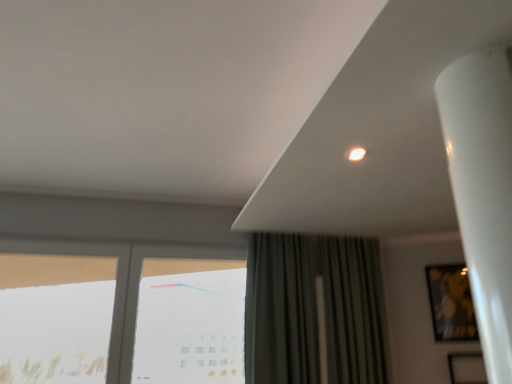
This screenshot has height=384, width=512. What do you see at coordinates (314, 310) in the screenshot? I see `dark green fabric curtain at center` at bounding box center [314, 310].

This screenshot has height=384, width=512. Identify the location of transparent glass window at left, positioned as the 1th window in left-to-right order. (55, 317).

Locate an element on the screen. This screenshot has height=384, width=512. dark green fabric curtain at center is located at coordinates (314, 310).

Is transparent glass window at center, marked as the 3th window in a left-to-right arrangement, facing away from transparent glass window at lower left, marked as the second window in a right-to-left arrangement?

Yes.

The width and height of the screenshot is (512, 384). In order to click on window located underneath the transparent glass window at lower left, marked as the second window in a right-to-left arrangement (from a real-world perspective) in this screenshot , I will do tap(190, 322).

Are transparent glass window at center, marked as the 3th window in a left-to-right arrangement, and transparent glass window at lower left, marked as the second window in a right-to-left arrangement, located far from each other?

They are positioned close to each other.

From a real-world perspective, is transparent glass window at center, marked as the 3th window in a left-to-right arrangement, physically located above or below transparent glass window at lower left, marked as the second window in a right-to-left arrangement?

Clearly, from a real-world perspective, transparent glass window at center, marked as the 3th window in a left-to-right arrangement, is below transparent glass window at lower left, marked as the second window in a right-to-left arrangement.

Looking at their sizes, would you say dark green fabric curtain at center is wider or thinner than transparent glass window at left, placed as the third window when sorted from right to left?

In the image, dark green fabric curtain at center appears to be wider than transparent glass window at left, placed as the third window when sorted from right to left.

Is dark green fabric curtain at center touching transparent glass window at left, positioned as the 1th window in left-to-right order?

dark green fabric curtain at center and transparent glass window at left, positioned as the 1th window in left-to-right order, are clearly separated.

Can you confirm if dark green fabric curtain at center is bigger than transparent glass window at left, positioned as the 1th window in left-to-right order?

Indeed, dark green fabric curtain at center has a larger size compared to transparent glass window at left, positioned as the 1th window in left-to-right order.

Looking at this image, which object is closer to the camera, transparent glass window at center, marked as the 3th window in a left-to-right arrangement, or metallic gold picture frame at right?

Answer: transparent glass window at center, marked as the 3th window in a left-to-right arrangement, is closer to the camera.

Does point (136, 360) come closer to viewer compared to point (464, 271)?

Yes, point (136, 360) is closer to viewer.

Based on their sizes in the image, would you say transparent glass window at center, which ranks as the first window in right-to-left order, is bigger or smaller than metallic gold picture frame at right?

transparent glass window at center, which ranks as the first window in right-to-left order, is bigger than metallic gold picture frame at right.

Are transparent glass window at left, placed as the third window when sorted from right to left, and metallic gold picture frame at right making contact?

No, transparent glass window at left, placed as the third window when sorted from right to left, is not in contact with metallic gold picture frame at right.

From a real-world perspective, is transparent glass window at left, positioned as the 1th window in left-to-right order, physically located above or below metallic gold picture frame at right?

From a real-world perspective, transparent glass window at left, positioned as the 1th window in left-to-right order, is physically below metallic gold picture frame at right.

From the image's perspective, is transparent glass window at left, placed as the third window when sorted from right to left, located beneath metallic gold picture frame at right?

No, from the image's perspective, transparent glass window at left, placed as the third window when sorted from right to left, is not below metallic gold picture frame at right.

Considering the positions of objects transparent glass window at lower left, the second window positioned from the left, and transparent glass window at center, marked as the 3th window in a left-to-right arrangement, in the image provided, who is in front, transparent glass window at lower left, the second window positioned from the left, or transparent glass window at center, marked as the 3th window in a left-to-right arrangement,?

transparent glass window at lower left, the second window positioned from the left, is in front.

Locate an element on the screen. This screenshot has width=512, height=384. the 2nd window in front when counting from the transparent glass window at center, which ranks as the first window in right-to-left order is located at coordinates point(120,314).

Is transparent glass window at lower left, marked as the second window in a right-to-left arrangement, shorter than transparent glass window at center, marked as the 3th window in a left-to-right arrangement?

In fact, transparent glass window at lower left, marked as the second window in a right-to-left arrangement, may be taller than transparent glass window at center, marked as the 3th window in a left-to-right arrangement.

What's the angular difference between transparent glass window at lower left, marked as the second window in a right-to-left arrangement, and transparent glass window at center, which ranks as the first window in right-to-left order,'s facing directions?

There is a 0.125-degree angle between the facing directions of transparent glass window at lower left, marked as the second window in a right-to-left arrangement, and transparent glass window at center, which ranks as the first window in right-to-left order.

Considering the relative sizes of transparent glass window at left, positioned as the 1th window in left-to-right order, and transparent glass window at center, which ranks as the first window in right-to-left order, in the image provided, is transparent glass window at left, positioned as the 1th window in left-to-right order, shorter than transparent glass window at center, which ranks as the first window in right-to-left order,?

Yes.

Can you see transparent glass window at left, positioned as the 1th window in left-to-right order, touching transparent glass window at center, marked as the 3th window in a left-to-right arrangement?

No, transparent glass window at left, positioned as the 1th window in left-to-right order, is not next to transparent glass window at center, marked as the 3th window in a left-to-right arrangement.

Can you tell me how much transparent glass window at left, placed as the third window when sorted from right to left, and transparent glass window at center, which ranks as the first window in right-to-left order, differ in facing direction?

The facing directions of transparent glass window at left, placed as the third window when sorted from right to left, and transparent glass window at center, which ranks as the first window in right-to-left order, are 0.124 degrees apart.

From a real-world perspective, is metallic gold picture frame at right positioned above or below transparent glass window at lower left, marked as the second window in a right-to-left arrangement?

In terms of real-world spatial position, metallic gold picture frame at right is above transparent glass window at lower left, marked as the second window in a right-to-left arrangement.

Is metallic gold picture frame at right next to transparent glass window at lower left, marked as the second window in a right-to-left arrangement, and touching it?

No, metallic gold picture frame at right is not next to transparent glass window at lower left, marked as the second window in a right-to-left arrangement.

Consider the image. Considering the relative sizes of metallic gold picture frame at right and transparent glass window at lower left, marked as the second window in a right-to-left arrangement, in the image provided, is metallic gold picture frame at right bigger than transparent glass window at lower left, marked as the second window in a right-to-left arrangement,?

No.

Find the location of a particular element. This screenshot has height=384, width=512. window that is the 2nd object located behind the transparent glass window at lower left, the second window positioned from the left is located at coordinates (190, 322).

Find the location of `curtain above the transparent glass window at left, placed as the third window when sorted from right to left (from the image's perspective)`. curtain above the transparent glass window at left, placed as the third window when sorted from right to left (from the image's perspective) is located at coordinates (314, 310).

When comparing their distances from dark green fabric curtain at center, does transparent glass window at lower left, the second window positioned from the left, or transparent glass window at left, placed as the third window when sorted from right to left, seem further?

The object further to dark green fabric curtain at center is transparent glass window at left, placed as the third window when sorted from right to left.

Based on the photo, estimate the real-world distances between objects in this image. Which object is closer to metallic gold picture frame at right, transparent glass window at left, positioned as the 1th window in left-to-right order, or transparent glass window at lower left, the second window positioned from the left?

transparent glass window at lower left, the second window positioned from the left, is positioned closer to the anchor metallic gold picture frame at right.

Based on their spatial positions, is transparent glass window at left, placed as the third window when sorted from right to left, or transparent glass window at center, which ranks as the first window in right-to-left order, closer to metallic gold picture frame at right?

transparent glass window at center, which ranks as the first window in right-to-left order, is positioned closer to the anchor metallic gold picture frame at right.

Estimate the real-world distances between objects in this image. Which object is further from dark green fabric curtain at center, transparent glass window at left, placed as the third window when sorted from right to left, or transparent glass window at lower left, the second window positioned from the left?

transparent glass window at left, placed as the third window when sorted from right to left, is further to dark green fabric curtain at center.

Considering their positions, is transparent glass window at center, marked as the 3th window in a left-to-right arrangement, positioned further to metallic gold picture frame at right than transparent glass window at left, positioned as the 1th window in left-to-right order?

transparent glass window at left, positioned as the 1th window in left-to-right order, is further to metallic gold picture frame at right.

Looking at the image, which one is located closer to transparent glass window at left, placed as the third window when sorted from right to left, transparent glass window at lower left, the second window positioned from the left, or dark green fabric curtain at center?

transparent glass window at lower left, the second window positioned from the left.

When comparing their distances from transparent glass window at center, marked as the 3th window in a left-to-right arrangement, does transparent glass window at lower left, the second window positioned from the left, or dark green fabric curtain at center seem further?

Among the two, dark green fabric curtain at center is located further to transparent glass window at center, marked as the 3th window in a left-to-right arrangement.

Estimate the real-world distances between objects in this image. Which object is closer to transparent glass window at center, marked as the 3th window in a left-to-right arrangement, transparent glass window at left, positioned as the 1th window in left-to-right order, or dark green fabric curtain at center?

Among the two, transparent glass window at left, positioned as the 1th window in left-to-right order, is located nearer to transparent glass window at center, marked as the 3th window in a left-to-right arrangement.

Identify the location of curtain between transparent glass window at center, marked as the 3th window in a left-to-right arrangement, and metallic gold picture frame at right, in the horizontal direction. tap(314, 310).

Identify the location of window situated between transparent glass window at left, placed as the third window when sorted from right to left, and transparent glass window at center, which ranks as the first window in right-to-left order, from left to right. Image resolution: width=512 pixels, height=384 pixels. (120, 314).

Where is `window between transparent glass window at lower left, marked as the second window in a right-to-left arrangement, and dark green fabric curtain at center from left to right`? Image resolution: width=512 pixels, height=384 pixels. window between transparent glass window at lower left, marked as the second window in a right-to-left arrangement, and dark green fabric curtain at center from left to right is located at coordinates (190, 322).

At what (x,y) coordinates should I click in order to perform the action: click on window between transparent glass window at lower left, the second window positioned from the left, and metallic gold picture frame at right, in the horizontal direction. Please return your answer as a coordinate pair (x, y). Looking at the image, I should click on (190, 322).